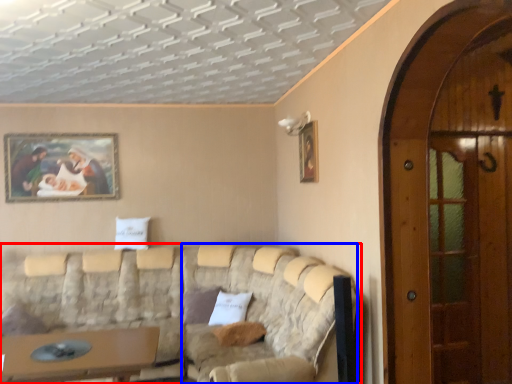
Question: Which point is further to the camera, studio couch (highlighted by a red box) or couch (highlighted by a blue box)?

Choices:
 (A) studio couch
 (B) couch

Answer: (B)